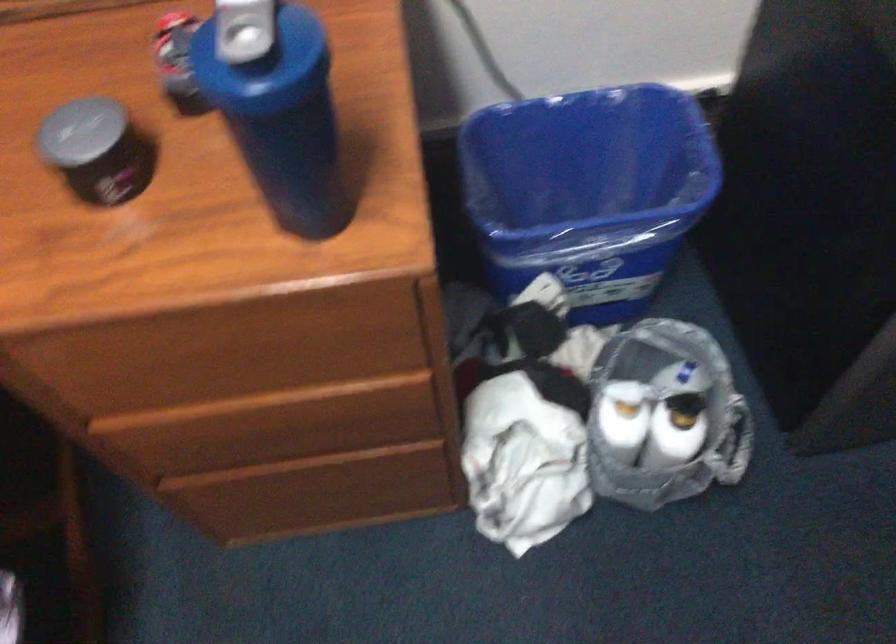
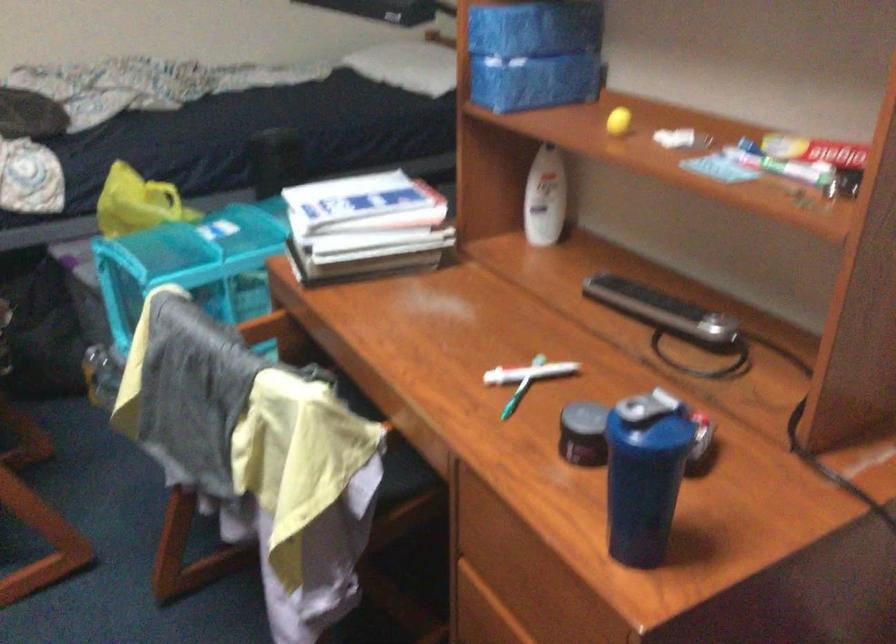
Locate, in the second image, the point that corresponds to (116,156) in the first image.

(584, 433)